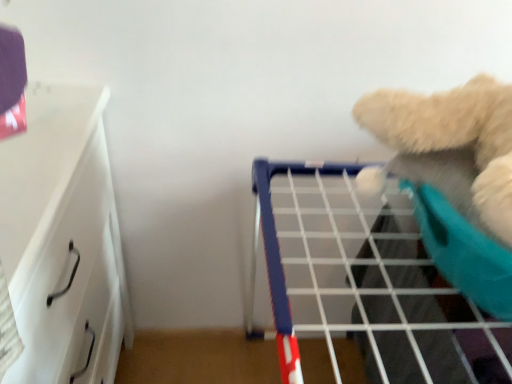
Question: Should I look upward or downward to see fluffy white teddy bear at upper right?

Choices:
 (A) down
 (B) up

Answer: (B)

Question: Is white wire shelf at upper right directly adjacent to fluffy white teddy bear at upper right?

Choices:
 (A) yes
 (B) no

Answer: (B)

Question: Is white wire shelf at upper right positioned behind fluffy white teddy bear at upper right?

Choices:
 (A) no
 (B) yes

Answer: (B)

Question: Considering the relative sizes of white wire shelf at upper right and fluffy white teddy bear at upper right in the image provided, is white wire shelf at upper right wider than fluffy white teddy bear at upper right?

Choices:
 (A) yes
 (B) no

Answer: (A)

Question: Can you confirm if white wire shelf at upper right is thinner than fluffy white teddy bear at upper right?

Choices:
 (A) yes
 (B) no

Answer: (B)

Question: From the image's perspective, is white wire shelf at upper right below fluffy white teddy bear at upper right?

Choices:
 (A) no
 (B) yes

Answer: (B)

Question: Does white wire shelf at upper right have a larger size compared to fluffy white teddy bear at upper right?

Choices:
 (A) no
 (B) yes

Answer: (B)

Question: Is white glossy drawer at left outside of white wire shelf at upper right?

Choices:
 (A) yes
 (B) no

Answer: (A)

Question: Is the depth of white glossy drawer at left less than that of white wire shelf at upper right?

Choices:
 (A) no
 (B) yes

Answer: (B)

Question: Does white glossy drawer at left contain white wire shelf at upper right?

Choices:
 (A) no
 (B) yes

Answer: (A)

Question: Is white glossy drawer at left aimed at white wire shelf at upper right?

Choices:
 (A) no
 (B) yes

Answer: (B)

Question: Is white glossy drawer at left bigger than white wire shelf at upper right?

Choices:
 (A) yes
 (B) no

Answer: (B)

Question: Considering the relative sizes of white glossy drawer at left and white wire shelf at upper right in the image provided, is white glossy drawer at left shorter than white wire shelf at upper right?

Choices:
 (A) yes
 (B) no

Answer: (B)

Question: Is the position of white wire shelf at upper right less distant than that of white glossy drawer at left?

Choices:
 (A) yes
 (B) no

Answer: (B)